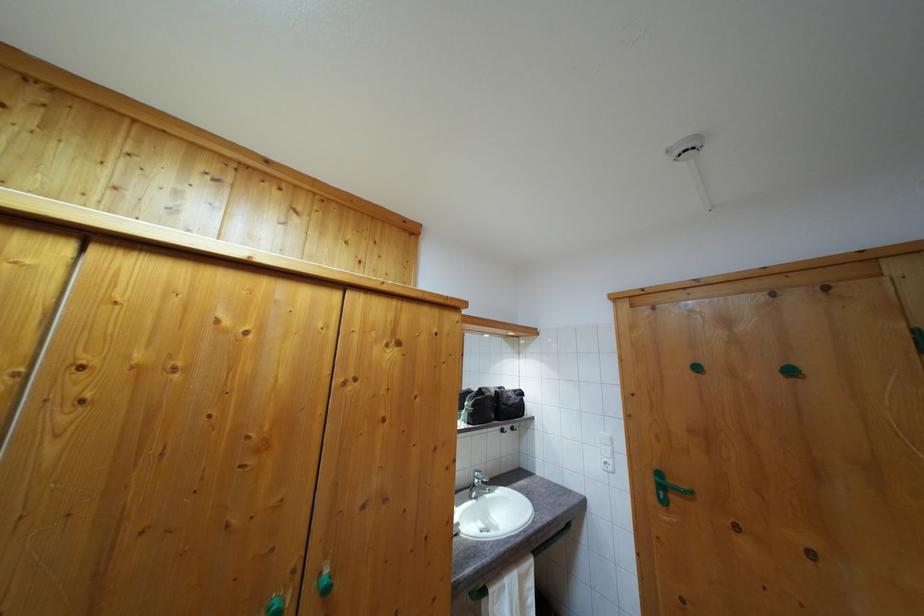
Find where to turn the green door handle. Please return your answer as a coordinate pair (x, y).

(666, 488)